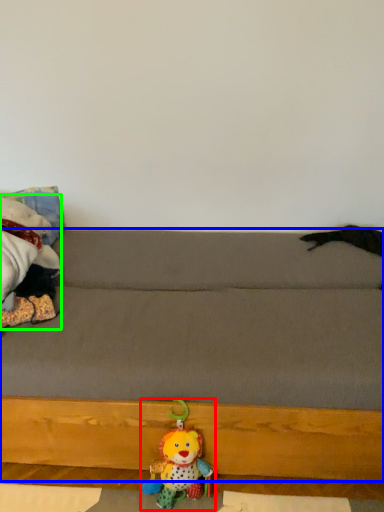
Question: Which object is the farthest from toy (highlighted by a red box)? Choose among these: studio couch (highlighted by a blue box) or toy (highlighted by a green box).

Choices:
 (A) studio couch
 (B) toy

Answer: (B)